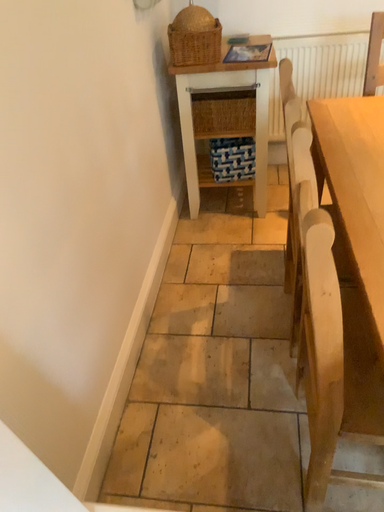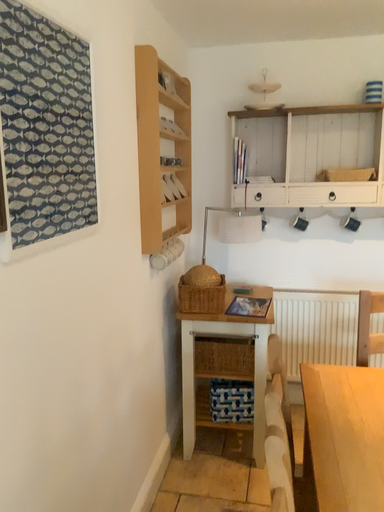
Question: Which way did the camera rotate in the video?

Choices:
 (A) rotated downward
 (B) rotated upward

Answer: (B)